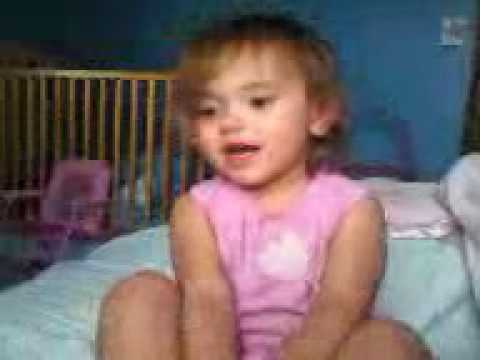
Find the location of `wall`. wall is located at coordinates (380, 64).